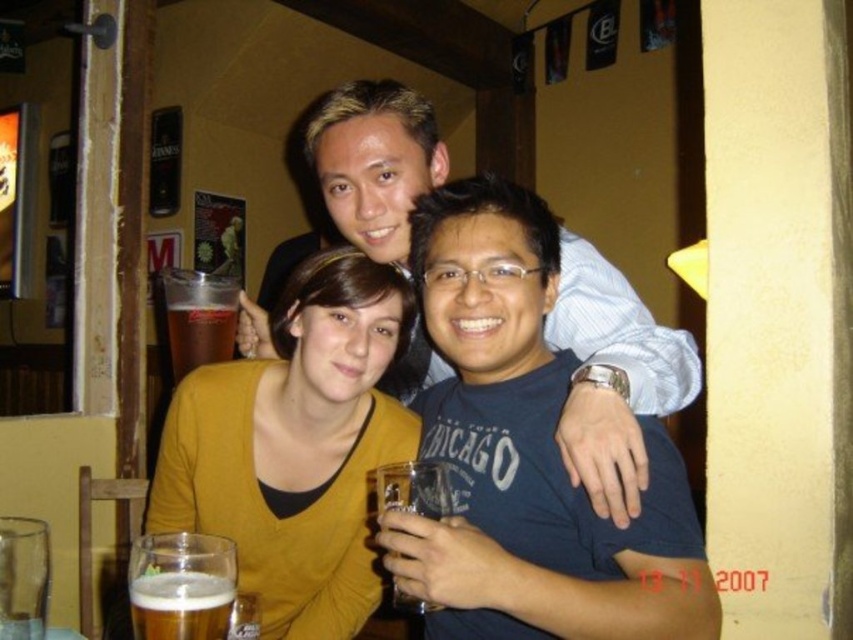
Question: Among these points, which one is nearest to the camera?

Choices:
 (A) (409, 493)
 (B) (207, 593)
 (C) (186, 460)

Answer: (B)

Question: Does yellow sweater at center have a larger size compared to matte black shirt at center?

Choices:
 (A) yes
 (B) no

Answer: (A)

Question: Does yellow sweater at center appear under translucent plastic cup at center?

Choices:
 (A) yes
 (B) no

Answer: (A)

Question: Based on their relative distances, which object is farther from the translucent glass beer at lower left?

Choices:
 (A) yellow sweater at center
 (B) blue cotton t-shirt at center
 (C) matte black shirt at center
 (D) translucent plastic cup at center

Answer: (D)

Question: Based on their relative distances, which object is farther from the matte black shirt at center?

Choices:
 (A) translucent glass beer at lower left
 (B) yellow sweater at center
 (C) blue cotton t-shirt at center

Answer: (A)

Question: Considering the relative positions of yellow sweater at center and matte black shirt at center in the image provided, where is yellow sweater at center located with respect to matte black shirt at center?

Choices:
 (A) above
 (B) below

Answer: (B)